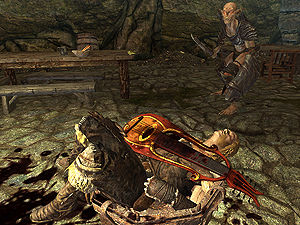
You are a GUI agent. You are given a task and a screenshot of the screen. Output one action in this format:
    pyautogui.click(x=<x>, y=<y>)
    Task: Click on the stone floor
    The image size is (300, 225).
    Given the screenshot: What is the action you would take?
    pyautogui.click(x=50, y=134)